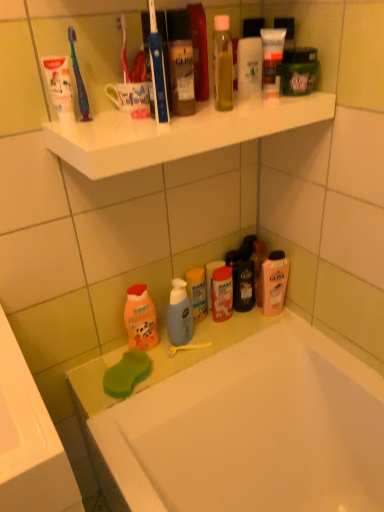
In order to click on free spot to the left of pink glossy mouthwash at lower right, the first mouthwash from the bottom in this screenshot , I will do `click(233, 329)`.